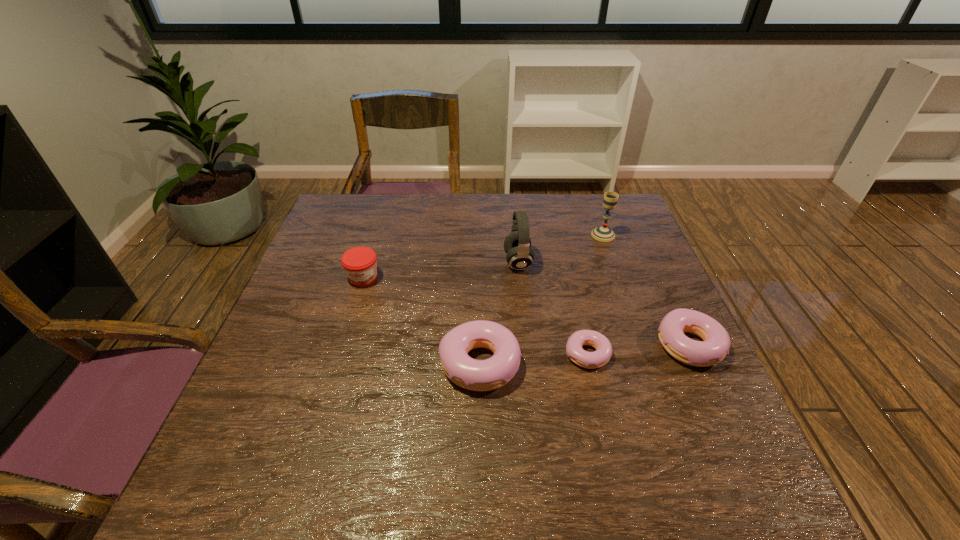
The height and width of the screenshot is (540, 960). I want to click on doughnut that can be found as the closest to the leftmost doughnut, so click(591, 360).

The height and width of the screenshot is (540, 960). In order to click on vacant position in the image that satisfies the following two spatial constraints: 1. on the label side of the rightmost doughnut; 2. on the left side of the jam in this screenshot , I will do `click(343, 346)`.

Find the location of `vacant space that satisfies the following two spatial constraints: 1. on the back side of the chalice; 2. on the right side of the shortest object`. vacant space that satisfies the following two spatial constraints: 1. on the back side of the chalice; 2. on the right side of the shortest object is located at coordinates (560, 235).

Locate an element on the screen. blank area in the image that satisfies the following two spatial constraints: 1. on the label side of the leftmost object; 2. on the right side of the shortest doughnut is located at coordinates (340, 354).

The width and height of the screenshot is (960, 540). In order to click on vacant space that satisfies the following two spatial constraints: 1. on the label side of the leftmost object; 2. on the right side of the second tallest doughnut in this screenshot , I will do `click(343, 346)`.

This screenshot has height=540, width=960. What are the coordinates of `free space that satisfies the following two spatial constraints: 1. on the ear cups of the headset; 2. on the back side of the rightmost doughnut` in the screenshot? It's located at (527, 346).

Identify the location of blank area in the image that satisfies the following two spatial constraints: 1. on the ear cups of the headset; 2. on the front side of the leftmost doughnut. This screenshot has height=540, width=960. (529, 363).

At what (x,y) coordinates should I click in order to perform the action: click on vacant space that satisfies the following two spatial constraints: 1. on the back side of the second doughnut from right to left; 2. on the left side of the rightmost doughnut. Please return your answer as a coordinate pair (x, y). This screenshot has width=960, height=540. Looking at the image, I should click on (586, 346).

In order to click on free region that satisfies the following two spatial constraints: 1. on the ear cups of the second tallest doughnut; 2. on the right side of the headset in this screenshot , I will do `click(527, 346)`.